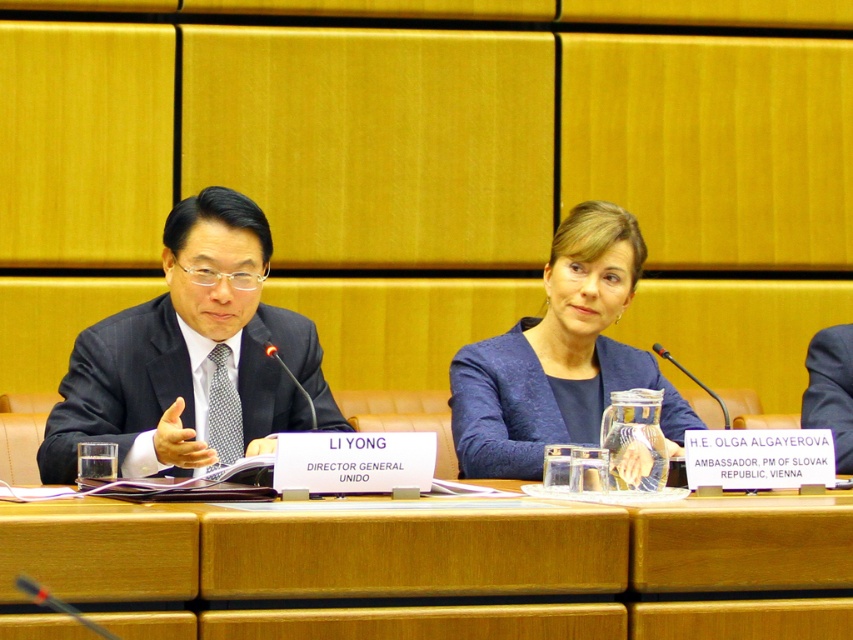
Is point (584, 275) farther from viewer compared to point (809, 394)?

That is False.

Does point (483, 371) lie behind point (822, 392)?

That is False.

Identify the location of blue fabric jacket at center. This screenshot has height=640, width=853. (560, 356).

Who is more distant from viewer, (x=598, y=253) or (x=48, y=451)?

The point (x=598, y=253) is more distant.

Between blue fabric jacket at center and matte black suit at left, which one is positioned lower?

Positioned lower is matte black suit at left.

You are a GUI agent. You are given a task and a screenshot of the screen. Output one action in this format:
    pyautogui.click(x=<x>, y=<y>)
    Task: Click on the blue fabric jacket at center
    
    Given the screenshot: What is the action you would take?
    pyautogui.click(x=560, y=356)

Can you confirm if wooden at center is thinner than matte black suit at left?

In fact, wooden at center might be wider than matte black suit at left.

Is wooden at center taller than matte black suit at left?

No.

Which is in front, point (196, 512) or point (57, 467)?

Point (196, 512)

The height and width of the screenshot is (640, 853). I want to click on wooden at center, so click(439, 563).